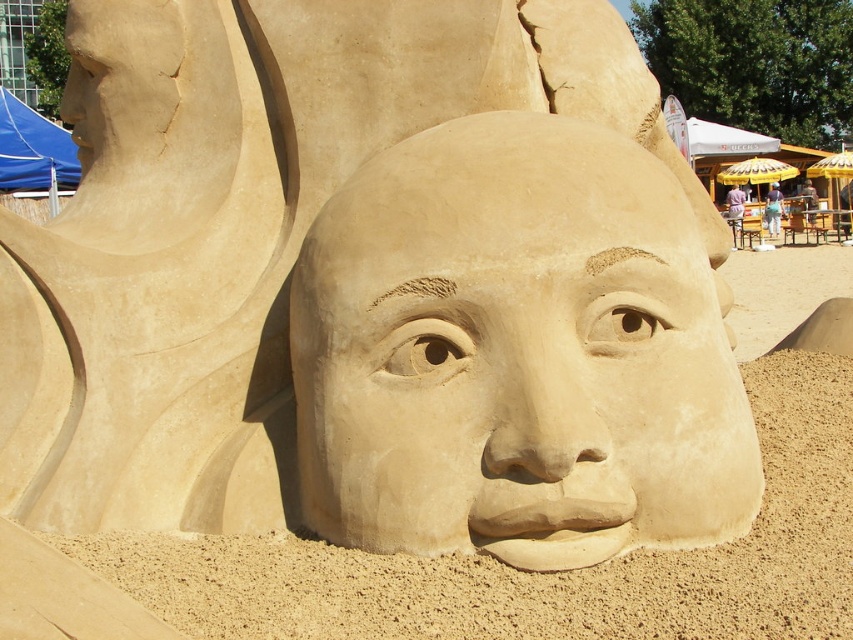
You are a photographer wanting to capture the smooth sand face at center and the smooth sand sculpture at center in a single shot. Since you can only focus on one object clearly, which one should you focus on to ensure it appears sharp in the photo?

You should focus on the smooth sand sculpture at center because the smooth sand face at center is behind it, so focusing on the closer object will keep it sharp while the background may blur slightly.

You are a sand sculptor who wants to place a small flag on top of the smooth sand sculpture at center. However, you need to ensure that the flag won not block the view of the smooth sand face at center. Can you do this?

The smooth sand sculpture at center is located above the smooth sand face at center, so placing the flag on top of the smooth sand sculpture at center would not block the view of the smooth sand face at center since it is positioned below.